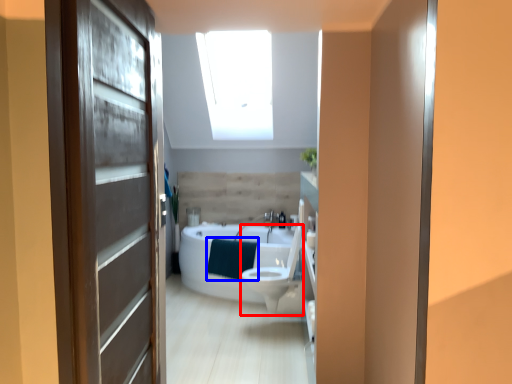
Question: Which of the following is the farthest to the observer, toilet bowl (highlighted by a red box) or blanket (highlighted by a blue box)?

Choices:
 (A) toilet bowl
 (B) blanket

Answer: (B)